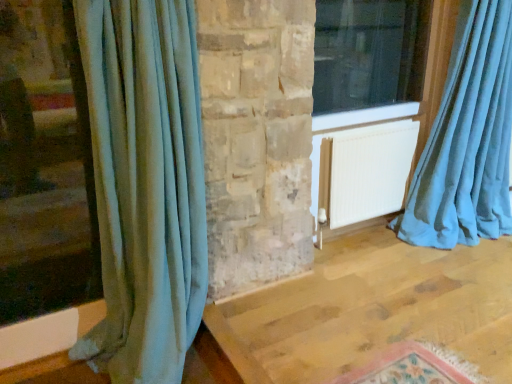
Image resolution: width=512 pixels, height=384 pixels. What do you see at coordinates (367, 57) in the screenshot?
I see `transparent glass window at upper right` at bounding box center [367, 57].

What do you see at coordinates (467, 139) in the screenshot?
I see `teal velvet curtain at right, acting as the second curtain starting from the left` at bounding box center [467, 139].

What is the approximate height of teal velvet curtain at right, the first curtain when ordered from right to left?

The height of teal velvet curtain at right, the first curtain when ordered from right to left, is 4.79 feet.

Locate an element on the screen. The height and width of the screenshot is (384, 512). transparent glass window at upper right is located at coordinates (367, 57).

From a real-world perspective, is transparent glass window at upper right beneath teal velvet curtain at right, acting as the second curtain starting from the left?

No, from a real-world perspective, transparent glass window at upper right is not below teal velvet curtain at right, acting as the second curtain starting from the left.

From the image's perspective, between transparent glass window at upper right and teal velvet curtain at right, acting as the second curtain starting from the left, which one is located above?

transparent glass window at upper right.

Could you tell me if transparent glass window at upper right is turned towards teal velvet curtain at right, the first curtain when ordered from right to left?

Yes, transparent glass window at upper right is oriented towards teal velvet curtain at right, the first curtain when ordered from right to left.

Can you confirm if transparent glass window at upper right is thinner than teal velvet curtain at right, acting as the second curtain starting from the left?

Indeed, transparent glass window at upper right has a lesser width compared to teal velvet curtain at right, acting as the second curtain starting from the left.

Which of these two, transparent glass window at upper right or velvet teal curtain at left, which ranks as the second curtain in right-to-left order, is thinner?

velvet teal curtain at left, which ranks as the second curtain in right-to-left order, is thinner.

Locate an element on the screen. window positioned vertically above the velvet teal curtain at left, the first curtain from the left (from a real-world perspective) is located at coordinates (367, 57).

Is transparent glass window at upper right at the right side of velvet teal curtain at left, the first curtain from the left?

Yes.

Is transparent glass window at upper right positioned far away from velvet teal curtain at left, the first curtain from the left?

transparent glass window at upper right is far away from velvet teal curtain at left, the first curtain from the left.

Based on their sizes in the image, would you say teal velvet curtain at right, the first curtain when ordered from right to left, is bigger or smaller than white matte radiator at center?

teal velvet curtain at right, the first curtain when ordered from right to left, is bigger than white matte radiator at center.

Is teal velvet curtain at right, acting as the second curtain starting from the left, oriented away from white matte radiator at center?

No, teal velvet curtain at right, acting as the second curtain starting from the left, is not facing the opposite direction of white matte radiator at center.

Does point (465, 93) lie in front of point (384, 127)?

Yes.

Identify the location of curtain in front of the teal velvet curtain at right, the first curtain when ordered from right to left. The height and width of the screenshot is (384, 512). (145, 185).

How different are the orientations of teal velvet curtain at right, the first curtain when ordered from right to left, and velvet teal curtain at left, which ranks as the second curtain in right-to-left order, in degrees?

teal velvet curtain at right, the first curtain when ordered from right to left, and velvet teal curtain at left, which ranks as the second curtain in right-to-left order, are facing 1.25 degrees away from each other.

Is teal velvet curtain at right, acting as the second curtain starting from the left, to the right of velvet teal curtain at left, which ranks as the second curtain in right-to-left order, from the viewer's perspective?

Yes.

Is teal velvet curtain at right, acting as the second curtain starting from the left, in front of or behind velvet teal curtain at left, which ranks as the second curtain in right-to-left order, in the image?

Visually, teal velvet curtain at right, acting as the second curtain starting from the left, is located behind velvet teal curtain at left, which ranks as the second curtain in right-to-left order.

From a real-world perspective, relative to transparent glass window at upper right, is white matte radiator at center vertically above or below?

Clearly, from a real-world perspective, white matte radiator at center is below transparent glass window at upper right.

From the image's perspective, which one is positioned lower, white matte radiator at center or transparent glass window at upper right?

white matte radiator at center is shown below in the image.

Who is smaller, white matte radiator at center or transparent glass window at upper right?

white matte radiator at center.

In terms of width, does white matte radiator at center look wider or thinner when compared to transparent glass window at upper right?

In the image, white matte radiator at center appears to be wider than transparent glass window at upper right.

In order to click on radiator located on the right of velvet teal curtain at left, the first curtain from the left in this screenshot , I will do `click(365, 171)`.

Is velvet teal curtain at left, the first curtain from the left, wider or thinner than white matte radiator at center?

velvet teal curtain at left, the first curtain from the left, is thinner than white matte radiator at center.

Are velvet teal curtain at left, which ranks as the second curtain in right-to-left order, and white matte radiator at center beside each other?

No.

How many degrees apart are the facing directions of velvet teal curtain at left, the first curtain from the left, and white matte radiator at center?

The angle between the facing direction of velvet teal curtain at left, the first curtain from the left, and the facing direction of white matte radiator at center is 0.12 degrees.

Is transparent glass window at upper right next to white matte radiator at center?

They are not placed beside each other.

Based on the photo, which of these two, transparent glass window at upper right or white matte radiator at center, stands shorter?

With less height is white matte radiator at center.

Which of these two, transparent glass window at upper right or white matte radiator at center, is wider?

Wider between the two is white matte radiator at center.

From the image's perspective, is transparent glass window at upper right on white matte radiator at center?

Indeed, from the image's perspective, transparent glass window at upper right is shown above white matte radiator at center.

The width and height of the screenshot is (512, 384). I want to click on window on the left side of teal velvet curtain at right, the first curtain when ordered from right to left, so click(x=367, y=57).

At what (x,y) coordinates should I click in order to perform the action: click on the 2nd curtain below the transparent glass window at upper right (from a real-world perspective). Please return your answer as a coordinate pair (x, y). Looking at the image, I should click on (145, 185).

Looking at the image, which one is located further to velvet teal curtain at left, which ranks as the second curtain in right-to-left order, teal velvet curtain at right, acting as the second curtain starting from the left, or white matte radiator at center?

The object further to velvet teal curtain at left, which ranks as the second curtain in right-to-left order, is teal velvet curtain at right, acting as the second curtain starting from the left.

When comparing their distances from white matte radiator at center, does teal velvet curtain at right, the first curtain when ordered from right to left, or velvet teal curtain at left, the first curtain from the left, seem further?

velvet teal curtain at left, the first curtain from the left.

Based on the photo, looking at the image, which one is located further to transparent glass window at upper right, velvet teal curtain at left, which ranks as the second curtain in right-to-left order, or teal velvet curtain at right, acting as the second curtain starting from the left?

velvet teal curtain at left, which ranks as the second curtain in right-to-left order, lies further to transparent glass window at upper right than the other object.

From the image, which object appears to be nearer to teal velvet curtain at right, acting as the second curtain starting from the left, velvet teal curtain at left, the first curtain from the left, or transparent glass window at upper right?

Based on the image, transparent glass window at upper right appears to be nearer to teal velvet curtain at right, acting as the second curtain starting from the left.

Which object lies further to the anchor point transparent glass window at upper right, velvet teal curtain at left, which ranks as the second curtain in right-to-left order, or white matte radiator at center?

velvet teal curtain at left, which ranks as the second curtain in right-to-left order.

Which object lies nearer to the anchor point teal velvet curtain at right, acting as the second curtain starting from the left, white matte radiator at center or transparent glass window at upper right?

white matte radiator at center.

When comparing their distances from teal velvet curtain at right, the first curtain when ordered from right to left, does velvet teal curtain at left, which ranks as the second curtain in right-to-left order, or white matte radiator at center seem closer?

white matte radiator at center is closer to teal velvet curtain at right, the first curtain when ordered from right to left.

Considering their positions, is transparent glass window at upper right positioned closer to white matte radiator at center than teal velvet curtain at right, acting as the second curtain starting from the left?

teal velvet curtain at right, acting as the second curtain starting from the left.

The width and height of the screenshot is (512, 384). Find the location of `radiator between transparent glass window at upper right and teal velvet curtain at right, the first curtain when ordered from right to left, from left to right`. radiator between transparent glass window at upper right and teal velvet curtain at right, the first curtain when ordered from right to left, from left to right is located at coordinates (365, 171).

Image resolution: width=512 pixels, height=384 pixels. I want to click on window between velvet teal curtain at left, which ranks as the second curtain in right-to-left order, and teal velvet curtain at right, acting as the second curtain starting from the left, from left to right, so click(x=367, y=57).

Locate an element on the screen. window located between velvet teal curtain at left, which ranks as the second curtain in right-to-left order, and white matte radiator at center in the left-right direction is located at coordinates pyautogui.click(x=367, y=57).

The width and height of the screenshot is (512, 384). Identify the location of radiator between velvet teal curtain at left, which ranks as the second curtain in right-to-left order, and teal velvet curtain at right, the first curtain when ordered from right to left, in the horizontal direction. (365, 171).